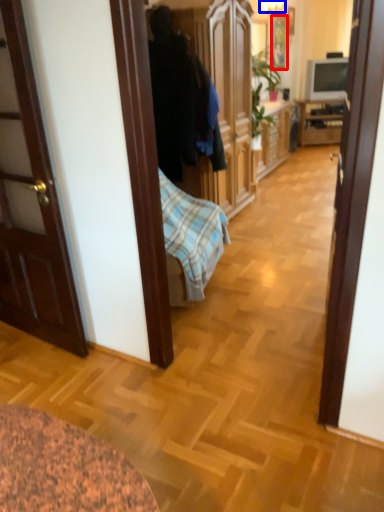
Question: Which point is closer to the camera, picture frame (highlighted by a red box) or lamp (highlighted by a blue box)?

Choices:
 (A) picture frame
 (B) lamp

Answer: (B)